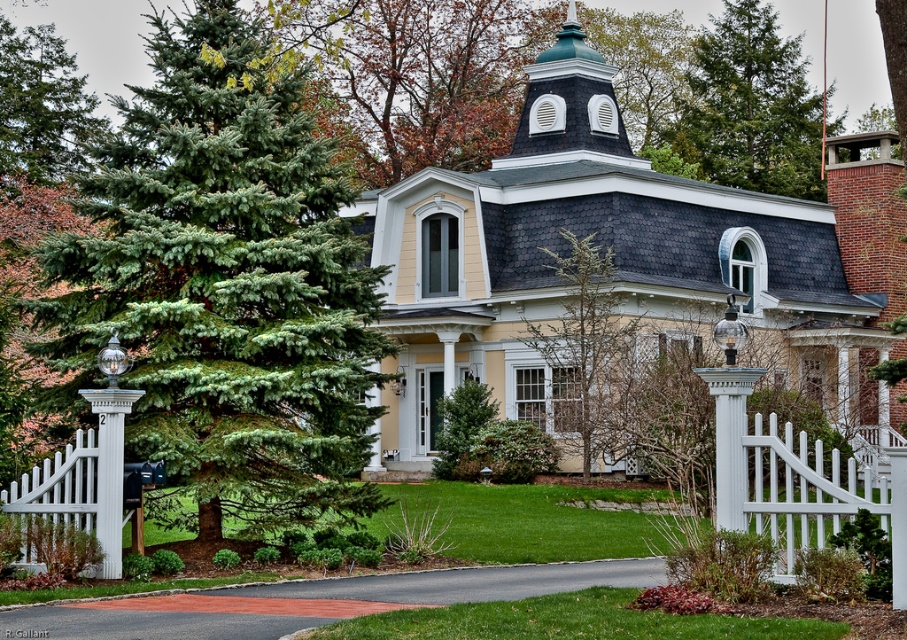
You are standing in front of the Victorian house and want to place a bird feeder exactly where the green evergreen tree at upper center is located. According to the image, what are the coordinates of the location where you should place the bird feeder?

The coordinates for the green evergreen tree at upper center are at point (x=749, y=106), so you should place the bird feeder at those coordinates.